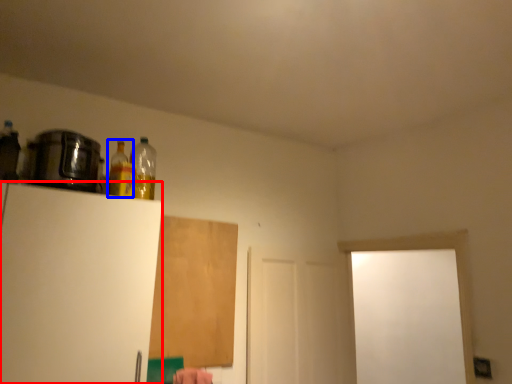
Question: Which point is further to the camera, appliance (highlighted by a red box) or bottle (highlighted by a blue box)?

Choices:
 (A) appliance
 (B) bottle

Answer: (B)